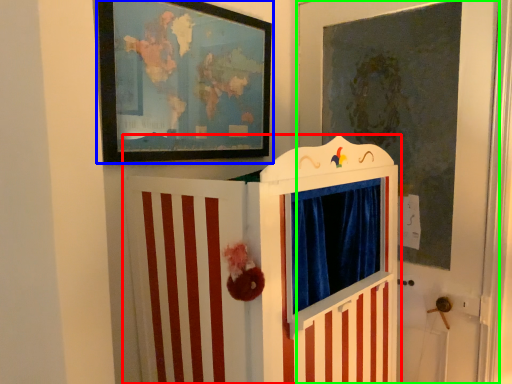
Question: Which is nearer to the furniture (highlighted by a red box)? picture frame (highlighted by a blue box) or door (highlighted by a green box).

Choices:
 (A) picture frame
 (B) door

Answer: (A)